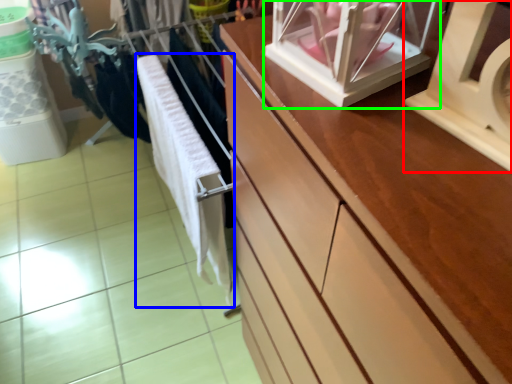
Question: Which is nearer to the wide (highlighted by a red box)? baby clothe (highlighted by a blue box) or glass box (highlighted by a green box).

Choices:
 (A) baby clothe
 (B) glass box

Answer: (B)